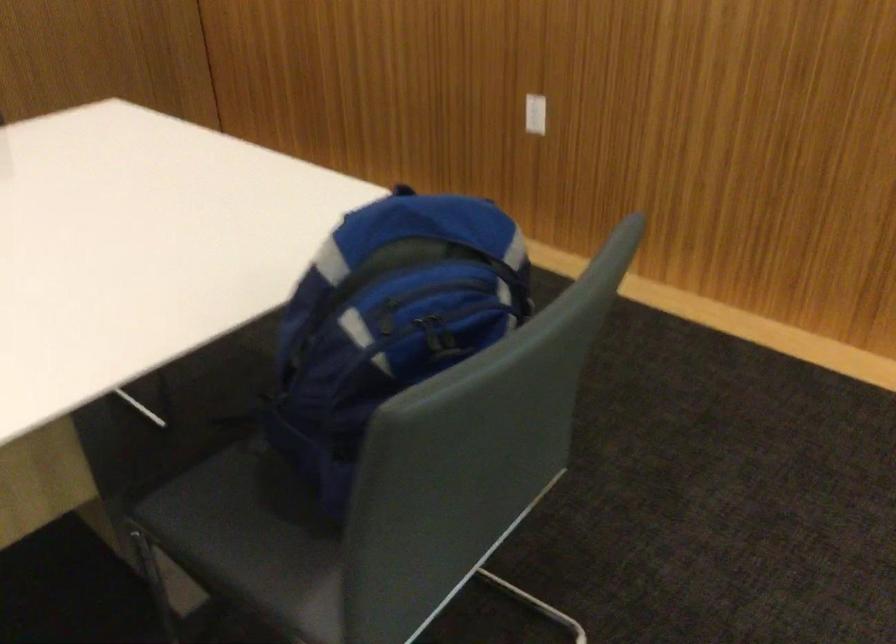
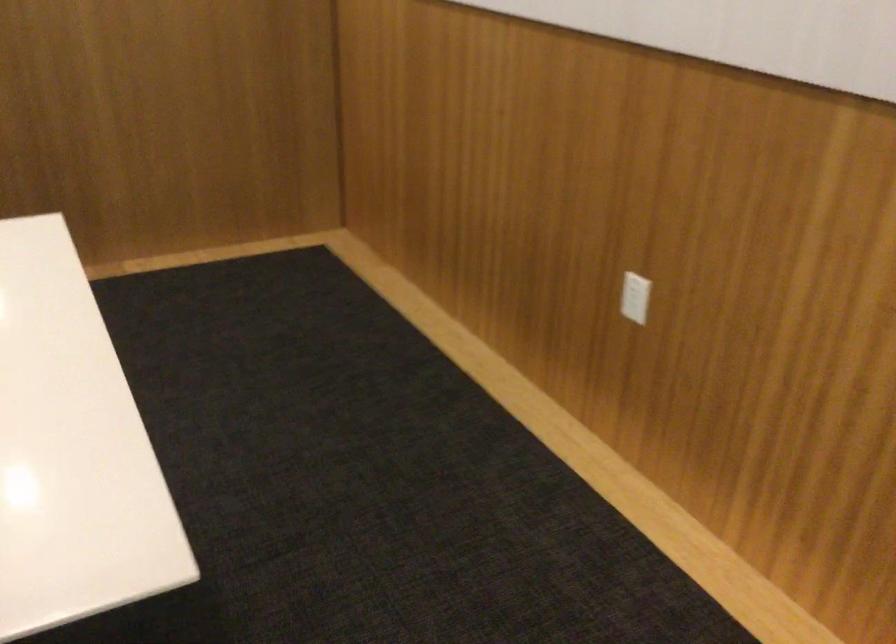
The images are taken continuously from a first-person perspective. In which direction are you moving?

The movement direction of the cameraman is right, forward.